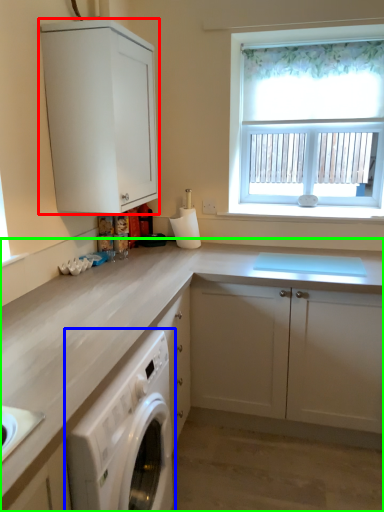
Question: Based on their relative distances, which object is nearer to cabinetry (highlighted by a red box)? Choose from home appliance (highlighted by a blue box) and cabinetry (highlighted by a green box).

Choices:
 (A) home appliance
 (B) cabinetry

Answer: (B)